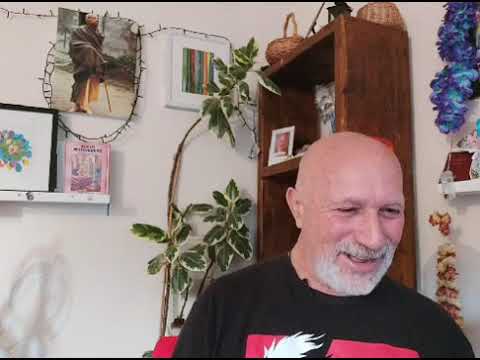
Where is `string lights`? string lights is located at coordinates (141, 74), (41, 92), (40, 17), (191, 31).